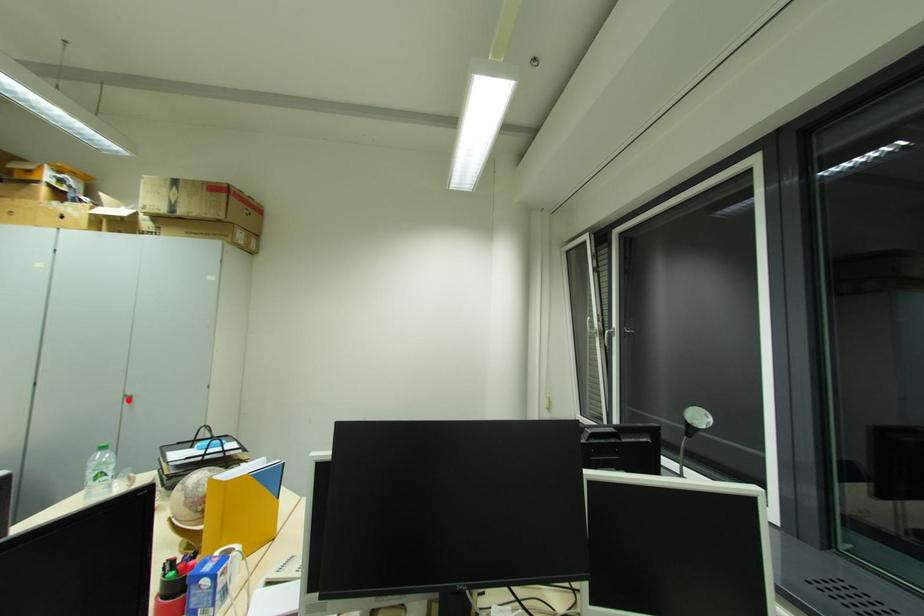
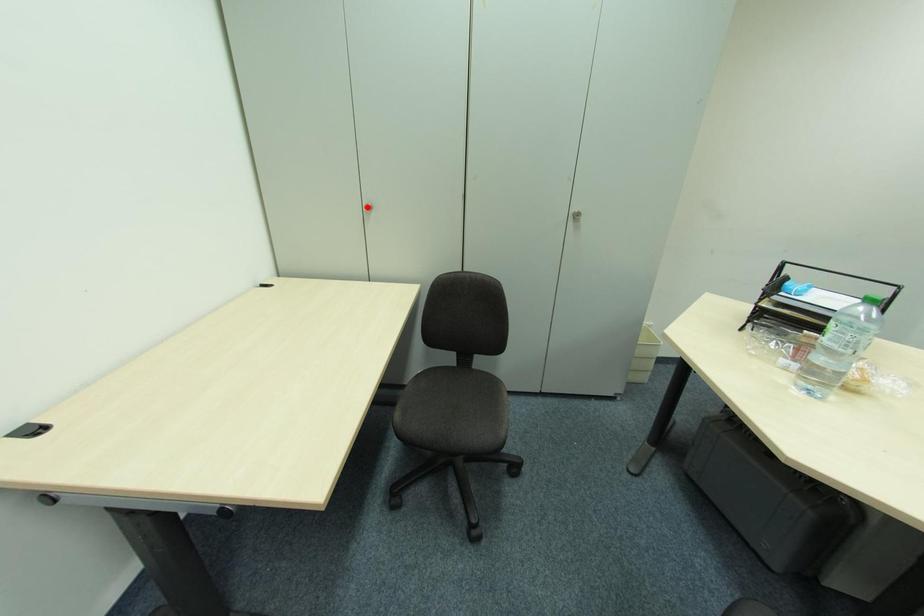
I am providing you with two images of the same scene from different viewpoints. A red point is marked on the first image and another point is marked on the second image. Are the points marked in image1 and image2 representing the same 3D position?

No